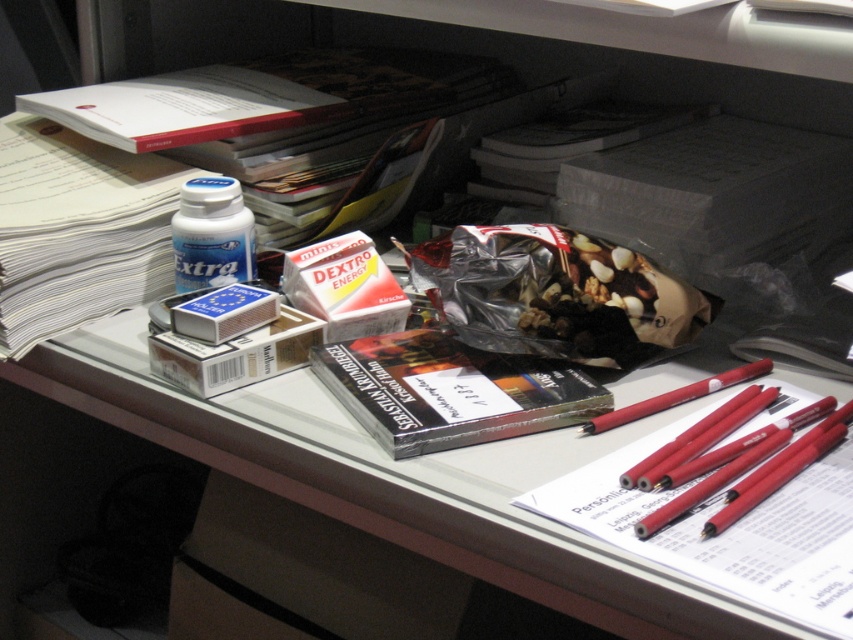
Who is positioned more to the right, matte plastic table at center or white glossy pill bottle at upper left?

matte plastic table at center is more to the right.

Between matte plastic table at center and white glossy pill bottle at upper left, which one is positioned lower?

matte plastic table at center

What do you see at coordinates (396, 483) in the screenshot? I see `matte plastic table at center` at bounding box center [396, 483].

Find the location of a particular element. matte plastic table at center is located at coordinates (396, 483).

Is white glossy pill bottle at upper left positioned behind red matte pencil at right?

Yes.

Which is in front, point (221, 262) or point (601, 419)?

Point (601, 419) is in front.

Where is `white glossy pill bottle at upper left`? Image resolution: width=853 pixels, height=640 pixels. white glossy pill bottle at upper left is located at coordinates (212, 234).

From the picture: Is matte plastic table at center below red matte pencil at right?

Correct, matte plastic table at center is located below red matte pencil at right.

Measure the distance between matte plastic table at center and camera.

matte plastic table at center is 17.92 inches away from camera.

Which is in front, point (643, 385) or point (709, 392)?

Point (709, 392) is in front.

You are a GUI agent. You are given a task and a screenshot of the screen. Output one action in this format:
    pyautogui.click(x=<x>, y=<y>)
    Task: Click on the matte plastic table at center
    
    Given the screenshot: What is the action you would take?
    pyautogui.click(x=396, y=483)